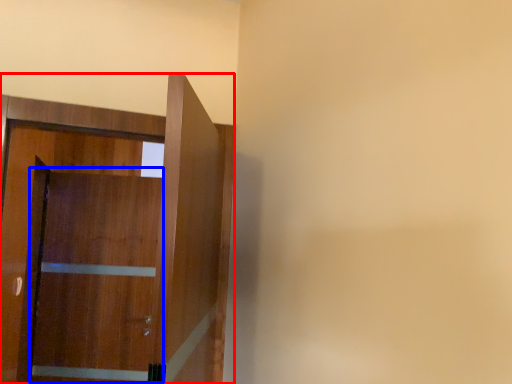
Question: Which object is closer to the camera taking this photo, door (highlighted by a red box) or barn door (highlighted by a blue box)?

Choices:
 (A) door
 (B) barn door

Answer: (A)